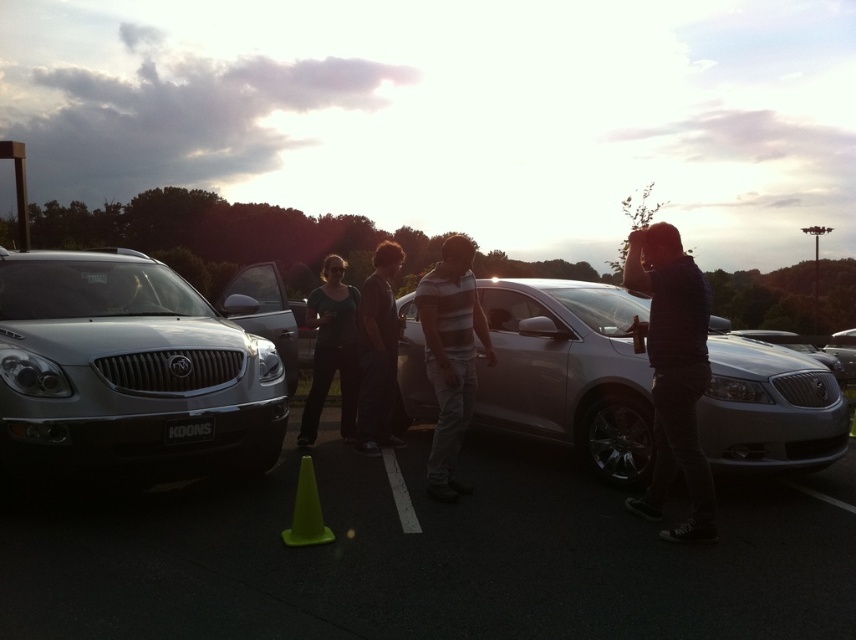
Question: Does satin silver suv at left have a lesser width compared to striped cotton shirt at center?

Choices:
 (A) no
 (B) yes

Answer: (A)

Question: Which object is positioned closest to the satin silver sedan at center?

Choices:
 (A) green plastic cone at center
 (B) satin silver suv at left

Answer: (A)

Question: Is green plastic cone at center closer to camera compared to green plastic traffic cone at lower center?

Choices:
 (A) yes
 (B) no

Answer: (A)

Question: Where is green plastic cone at center located in relation to satin silver grille at center in the image?

Choices:
 (A) left
 (B) right

Answer: (B)

Question: Which object is farther from the camera taking this photo?

Choices:
 (A) dark gray jeans at center
 (B) satin silver suv at left

Answer: (A)

Question: Which object is closer to the camera taking this photo?

Choices:
 (A) dark gray jeans at center
 (B) green plastic traffic cone at lower center
 (C) dark blue denim jeans at right
 (D) matte black shirt at center

Answer: (C)